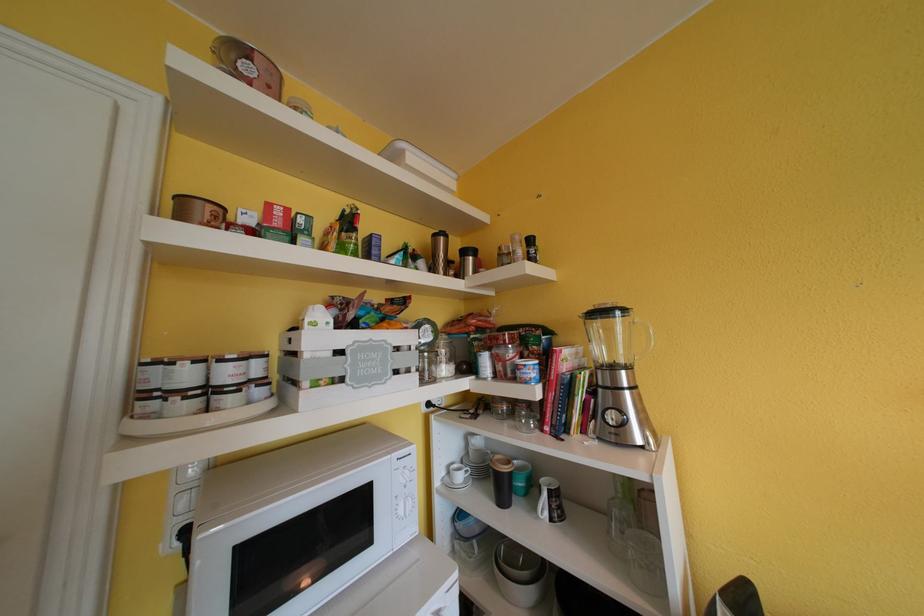
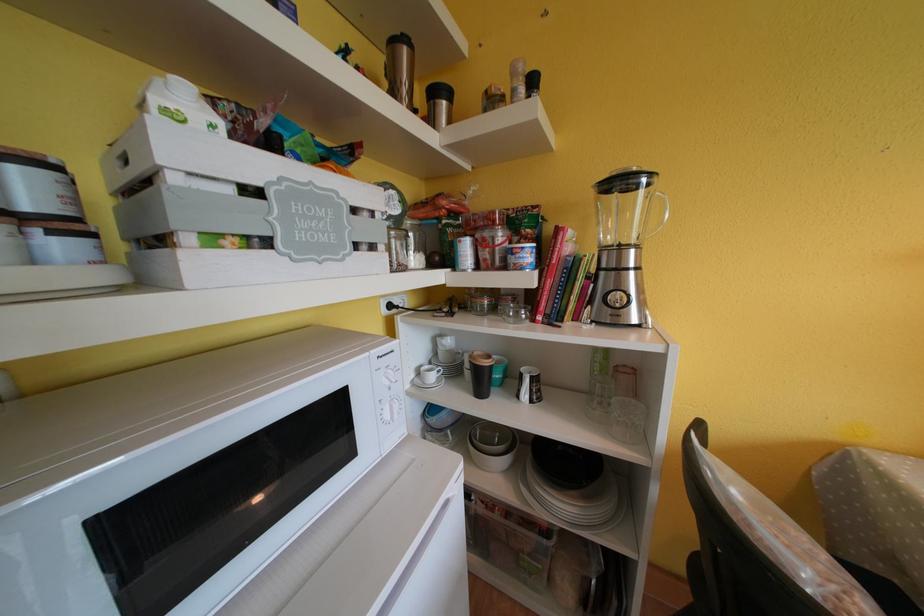
Locate, in the second image, the point that corresponds to (x=629, y=375) in the first image.

(638, 254)